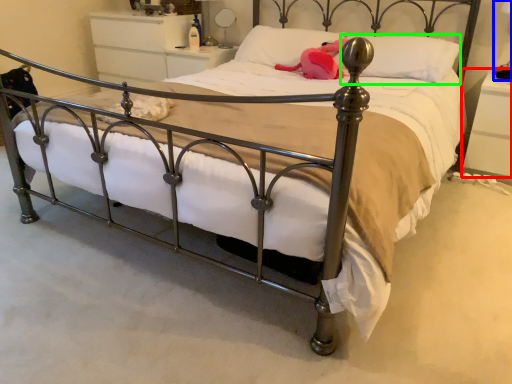
Question: Which object is positioned farthest from nightstand (highlighted by a red box)? Select from table lamp (highlighted by a blue box) and pillow (highlighted by a green box).

Choices:
 (A) table lamp
 (B) pillow

Answer: (B)